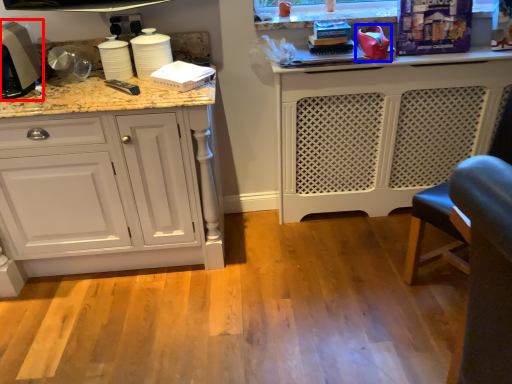
Question: Which point is further to the camera, home appliance (highlighted by a red box) or appliance (highlighted by a blue box)?

Choices:
 (A) home appliance
 (B) appliance

Answer: (B)